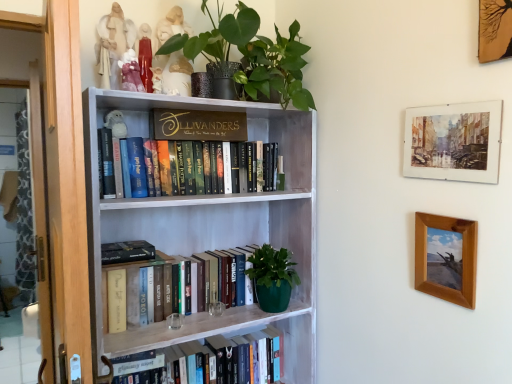
Question: Is point (269, 372) closer or farther from the camera than point (237, 81)?

Choices:
 (A) farther
 (B) closer

Answer: (A)

Question: From the image's perspective, relative to green matte plant at upper center, is hardcover book at lower center, which is counted as the first book, starting from the bottom, above or below?

Choices:
 (A) above
 (B) below

Answer: (B)

Question: Which object is positioned farthest from the hardcover books at upper center, the 2th book positioned from the top?

Choices:
 (A) matte porcelain figurine at upper center, which is the third toy from bottom to top
 (B) porcelain figurine at upper center, which appears as the 3th toy when viewed from the top
 (C) white wood bookcase at center
 (D) hardcover book at lower center, marked as the 4th book in a top-to-bottom arrangement
 (E) green matte plant at upper center

Answer: (D)

Question: Estimate the real-world distances between objects in this image. Which object is closer to the wooden picture frame at upper right, arranged as the 3th picture frame when ordered from the bottom?

Choices:
 (A) hardcover books at upper center, the 2th book positioned from the top
 (B) white plush owl at upper left, the 4th toy when ordered from top to bottom
 (C) matte white figurine at upper left, the 1th toy viewed from the top
 (D) hardcover book at center, the 2th book positioned from the bottom
 (E) transparent glass door at left

Answer: (A)